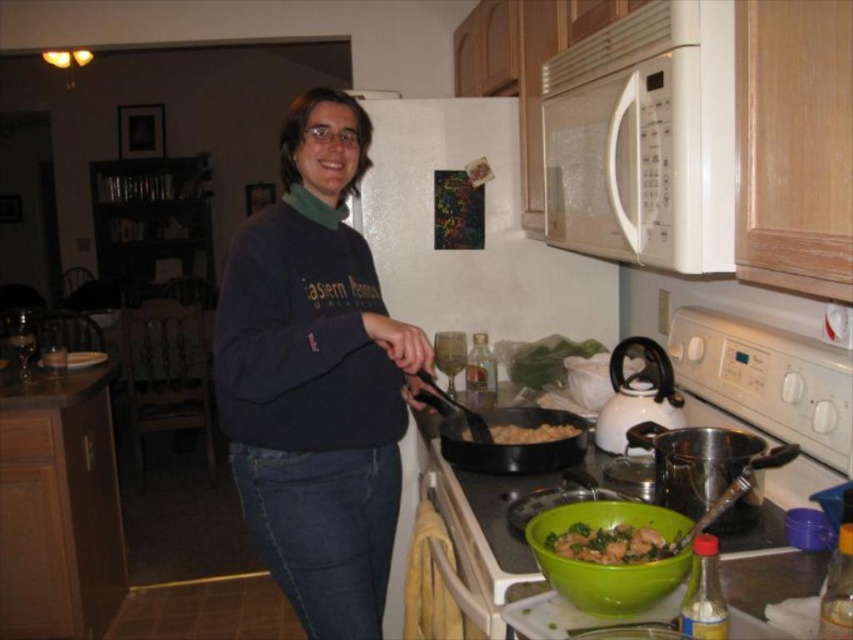
Question: Which point is closer to the camera?

Choices:
 (A) brown matte pan at center
 (B) white matte microwave at upper center
 (C) green matte bowl at lower center
 (D) black matte wok at center

Answer: (C)

Question: Does dark blue sweater at center have a larger size compared to brown matte pan at center?

Choices:
 (A) yes
 (B) no

Answer: (A)

Question: Is white matte microwave at upper center wider than brown matte pan at center?

Choices:
 (A) no
 (B) yes

Answer: (A)

Question: Estimate the real-world distances between objects in this image. Which object is farther from the green matte bowl at lower center?

Choices:
 (A) black matte wok at center
 (B) white matte microwave at upper center
 (C) dark blue sweater at center
 (D) brown matte pan at center

Answer: (B)

Question: Is dark blue sweater at center bigger than green matte bowl at lower center?

Choices:
 (A) no
 (B) yes

Answer: (B)

Question: Which point is farther to the camera?

Choices:
 (A) white matte microwave at upper center
 (B) dark blue sweater at center
 (C) green matte bowl at lower center
 (D) brown matte pan at center

Answer: (D)